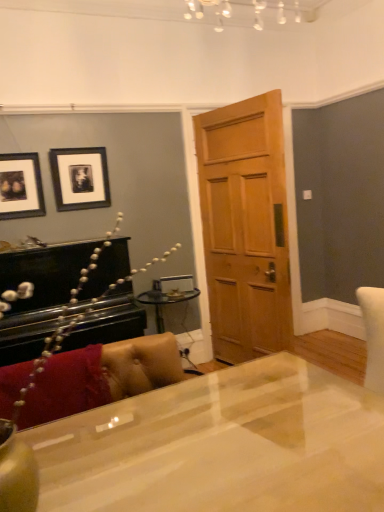
You are a GUI agent. You are given a task and a screenshot of the screen. Output one action in this format:
    pyautogui.click(x=<x>, y=<y>)
    Task: Click on the blank space above black matte picture frame at upper left, placed as the 2th picture frame when sorted from left to right (from a real-world perspective)
    This screenshot has width=384, height=512.
    Given the screenshot: What is the action you would take?
    pyautogui.click(x=75, y=148)